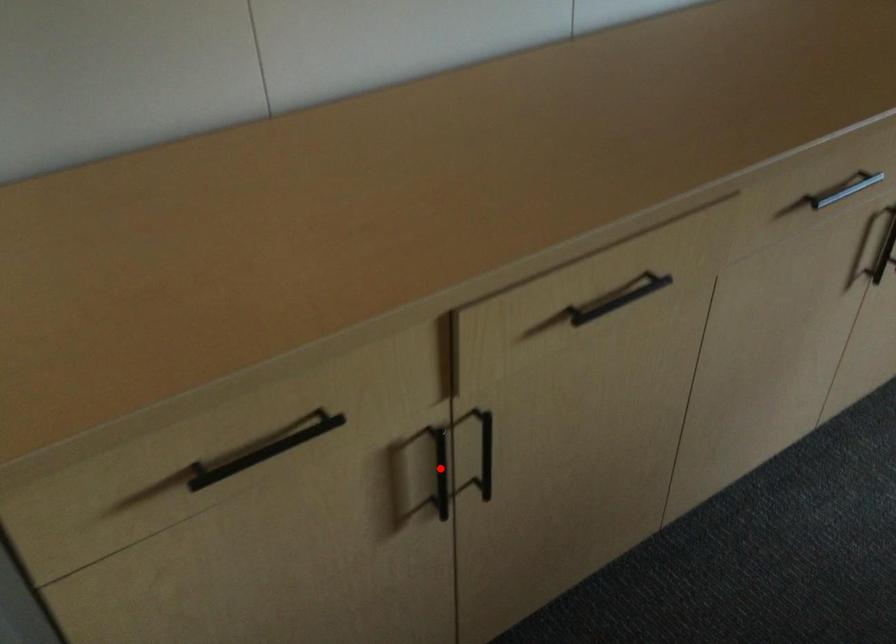
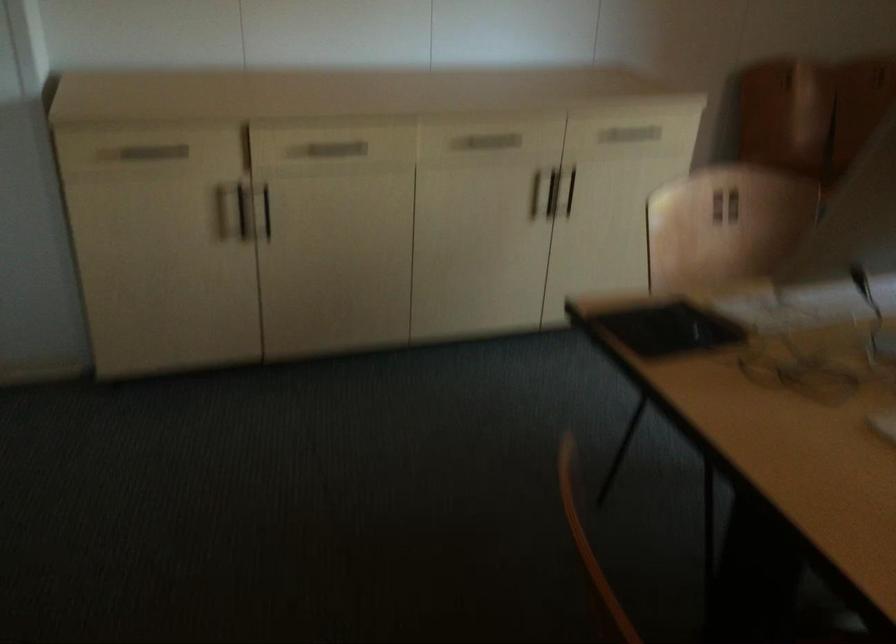
Find the pixel in the second image that matches the highlighted location in the first image.

(243, 211)